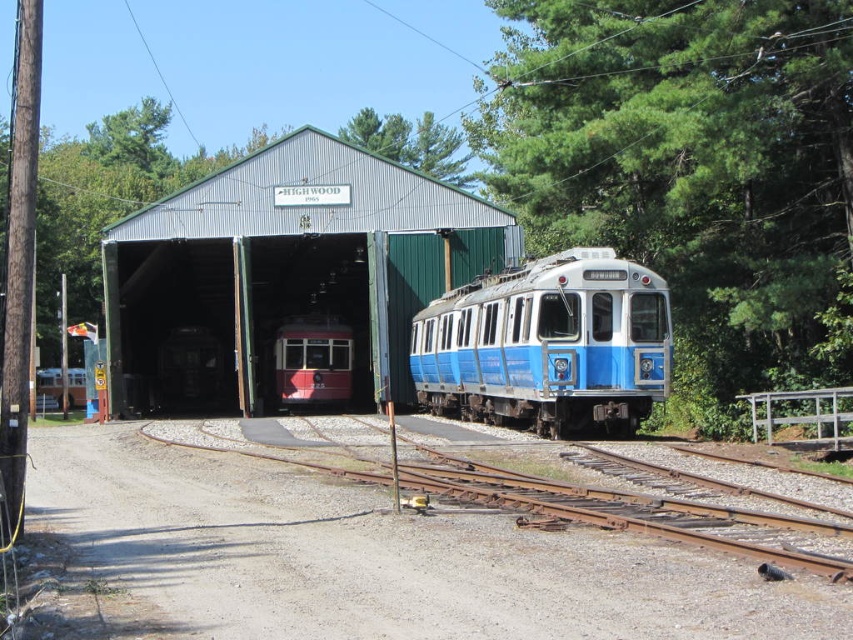
Question: Is dirt gravel at lower center bigger than matte red train at center?

Choices:
 (A) yes
 (B) no

Answer: (A)

Question: Is dirt gravel at lower center positioned at the back of matte red train at center?

Choices:
 (A) no
 (B) yes

Answer: (A)

Question: Which is farther from the blue polished metal train at center?

Choices:
 (A) matte red train at center
 (B) dirt gravel at lower center
 (C) green corrugated metal train shed at center

Answer: (C)

Question: Among these objects, which one is farthest from the camera?

Choices:
 (A) green corrugated metal train shed at center
 (B) blue polished metal train at center
 (C) dirt gravel at lower center

Answer: (A)

Question: Is green corrugated metal train shed at center above matte red train at center?

Choices:
 (A) no
 (B) yes

Answer: (B)

Question: Which object is farther from the camera taking this photo?

Choices:
 (A) green corrugated metal train shed at center
 (B) blue polished metal train at center
 (C) dirt gravel at lower center

Answer: (A)